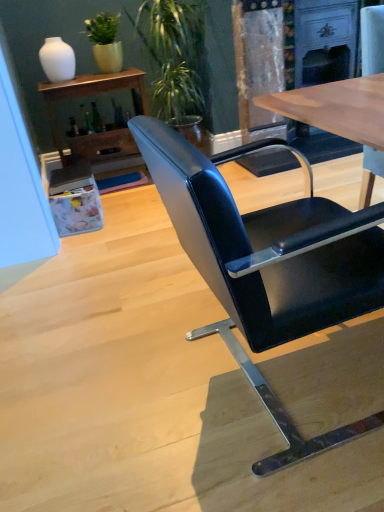
The width and height of the screenshot is (384, 512). Identify the location of vacant space underneath black leather chair at center (from a real-world perspective). (292, 380).